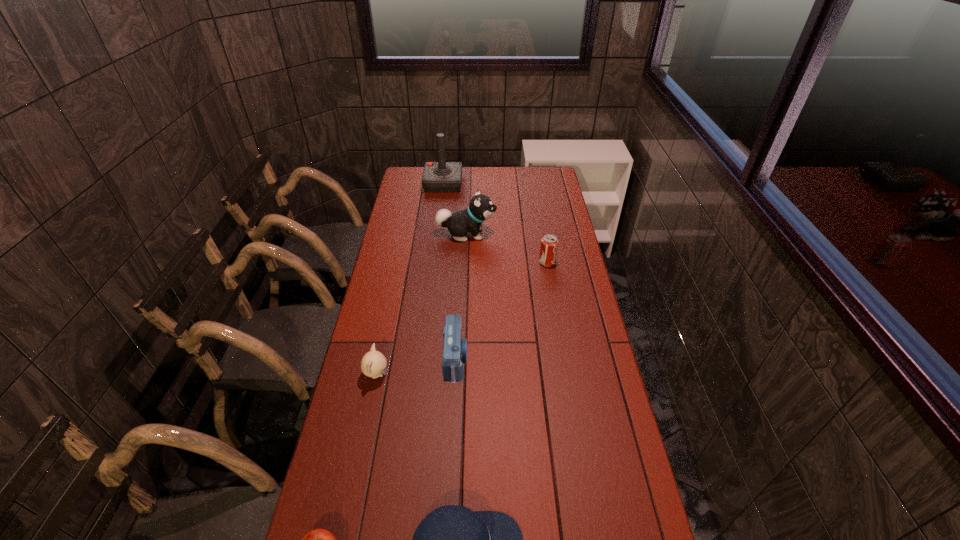
This screenshot has width=960, height=540. Identify the location of the tallest object. (438, 177).

At what (x,y) coordinates should I click in order to perform the action: click on joystick. Please return your answer as a coordinate pair (x, y). The image size is (960, 540). Looking at the image, I should click on (438, 177).

Image resolution: width=960 pixels, height=540 pixels. Find the location of `the second farthest object`. the second farthest object is located at coordinates (481, 207).

Find the location of a particular element. The height and width of the screenshot is (540, 960). puppy is located at coordinates pos(481,207).

The height and width of the screenshot is (540, 960). Identify the location of the rightmost object. (549, 243).

The height and width of the screenshot is (540, 960). I want to click on soda can, so click(x=549, y=243).

Locate an element on the screen. This screenshot has height=540, width=960. camera is located at coordinates (454, 354).

Identify the location of kitten. (373, 364).

The width and height of the screenshot is (960, 540). I want to click on blank area located 0.340m on the rectangular base of the joystick, so click(x=437, y=234).

The width and height of the screenshot is (960, 540). I want to click on vacant area situated at the face of the second farthest object, so click(x=526, y=234).